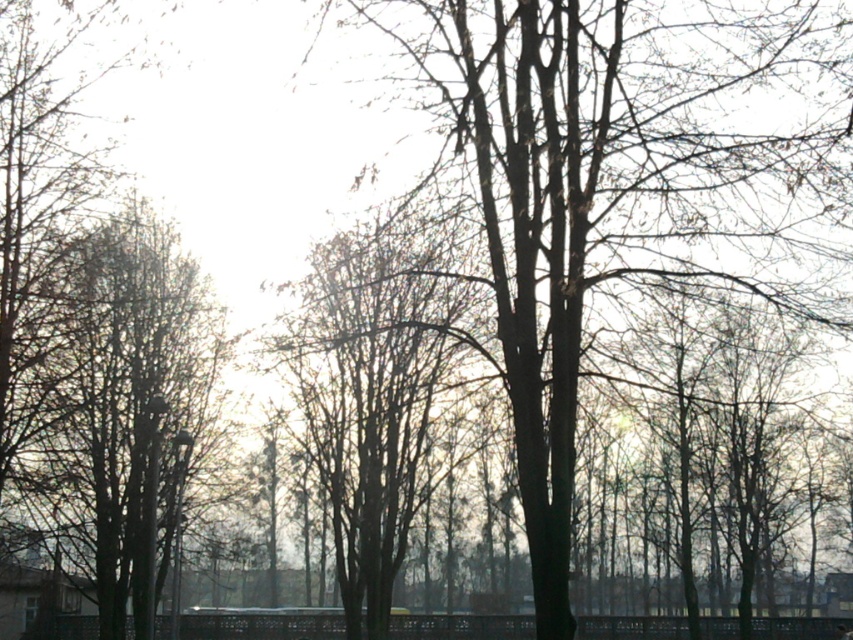
Question: Does smooth bark tree at center have a lesser width compared to bare branches at center?

Choices:
 (A) yes
 (B) no

Answer: (A)

Question: Is smooth bark tree at center to the right of smooth brown tree at left from the viewer's perspective?

Choices:
 (A) yes
 (B) no

Answer: (A)

Question: Which of these objects is positioned farthest from the bare branches at center?

Choices:
 (A) smooth bark tree at center
 (B) smooth brown tree at left

Answer: (A)

Question: Which object is positioned closest to the smooth brown tree at left?

Choices:
 (A) smooth bark tree at center
 (B) bare branches at center

Answer: (B)

Question: Does smooth brown tree at left have a lesser width compared to bare branches at center?

Choices:
 (A) yes
 (B) no

Answer: (A)

Question: Which object is farther from the camera taking this photo?

Choices:
 (A) smooth brown tree at left
 (B) bare branches at center

Answer: (A)